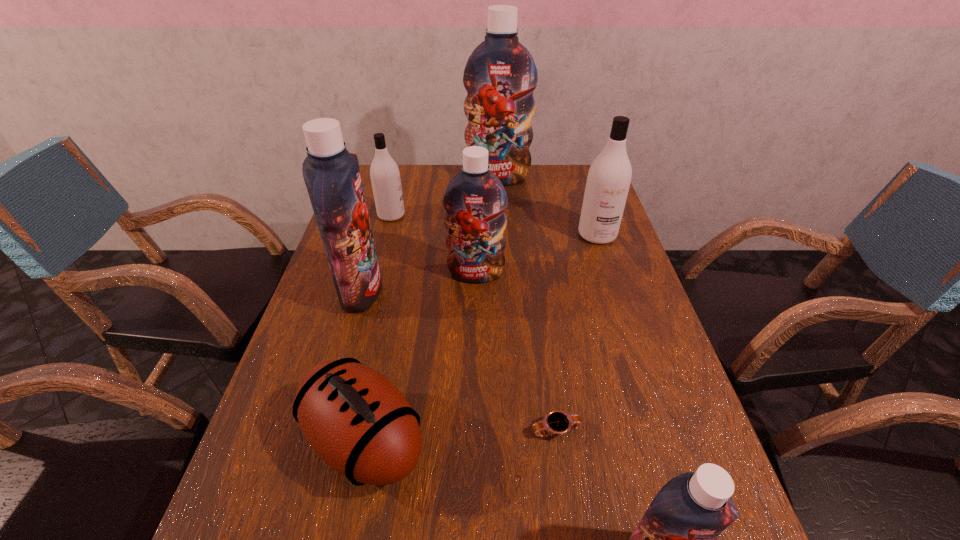
You are a GUI agent. You are given a task and a screenshot of the screen. Output one action in this format:
    pyautogui.click(x=<x>, y=<y>)
    Task: Click on the object located at the far edge
    This screenshot has height=540, width=960.
    Given the screenshot: What is the action you would take?
    pyautogui.click(x=500, y=75)

Where is `football (American) that is at the left edge`? The width and height of the screenshot is (960, 540). football (American) that is at the left edge is located at coordinates (356, 420).

The width and height of the screenshot is (960, 540). I want to click on object present at the right edge, so click(x=609, y=177).

The width and height of the screenshot is (960, 540). I want to click on vacant space at the far edge of the desktop, so click(428, 179).

Where is `free space at the left edge of the desktop`? This screenshot has width=960, height=540. free space at the left edge of the desktop is located at coordinates (320, 353).

The image size is (960, 540). What are the coordinates of `vacant region at the right edge of the desktop` in the screenshot? It's located at (668, 367).

In the image, there is a desktop. Where is `free space at the far right corner`? The image size is (960, 540). free space at the far right corner is located at coordinates (575, 176).

Locate an element on the screen. vacant space that's between the third biggest blue shampoo and the second shortest object is located at coordinates (420, 357).

The height and width of the screenshot is (540, 960). I want to click on free space between the tallest object and the seventh shortest object, so click(429, 234).

In order to click on vacant space in between the watch and the second tallest shampoo in this screenshot , I will do click(x=459, y=361).